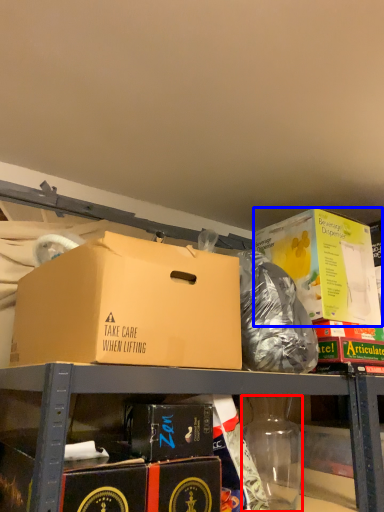
Question: Which point is closer to the camera, bottle (highlighted by a red box) or box (highlighted by a blue box)?

Choices:
 (A) bottle
 (B) box

Answer: (A)